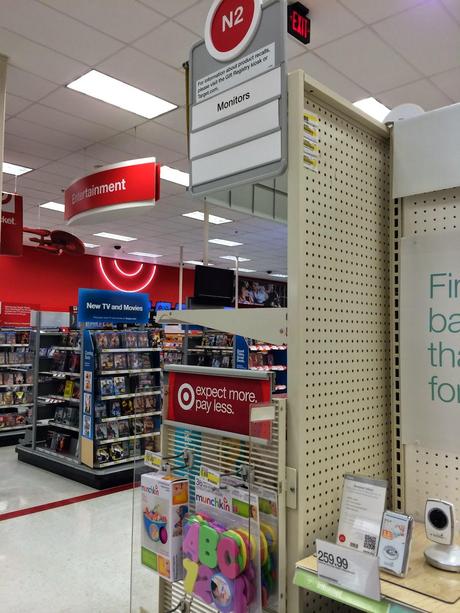
You are a GUI agent. You are given a task and a screenshot of the screen. Output one action in this format:
    pyautogui.click(x=<x>, y=<y>)
    Task: Click on the red stripe on floor
    
    Given the screenshot: What is the action you would take?
    pyautogui.click(x=79, y=498)